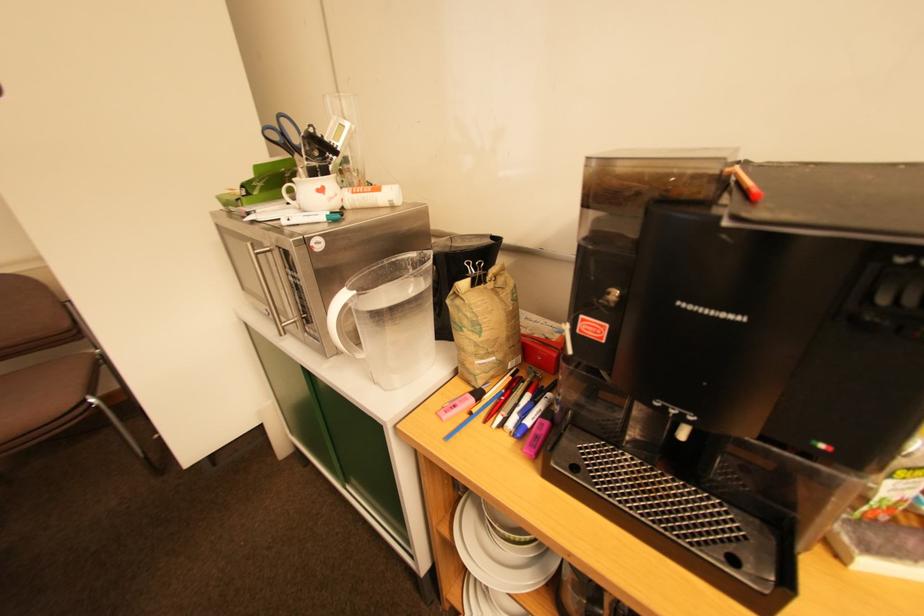
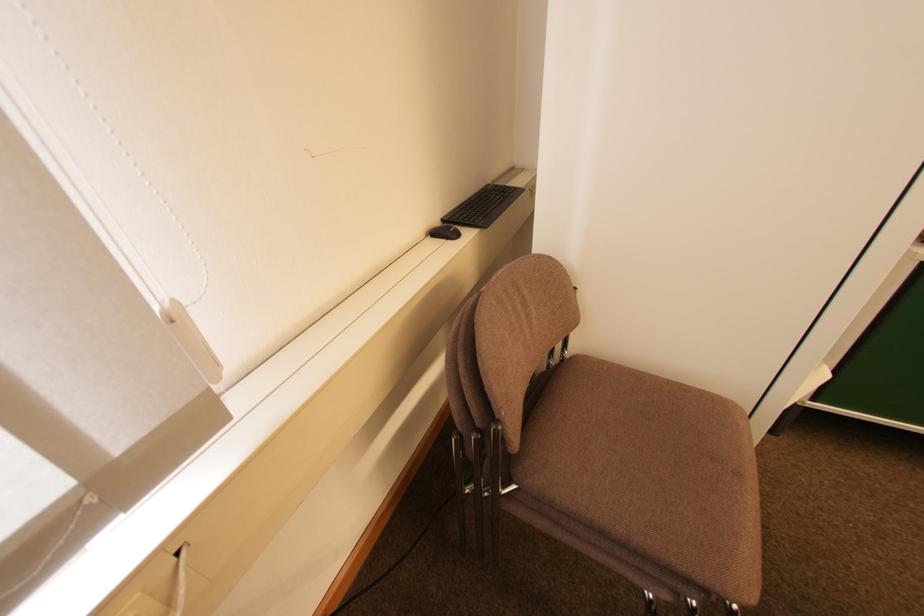
Question: What movement of the cameraman would produce the second image?

Choices:
 (A) Left
 (B) Right
 (C) Forward
 (D) Backward

Answer: (A)